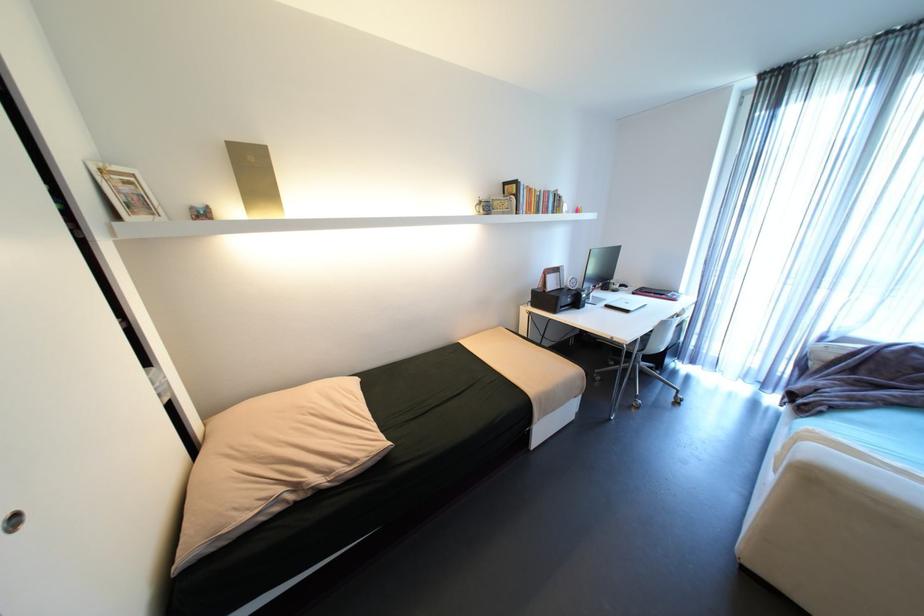
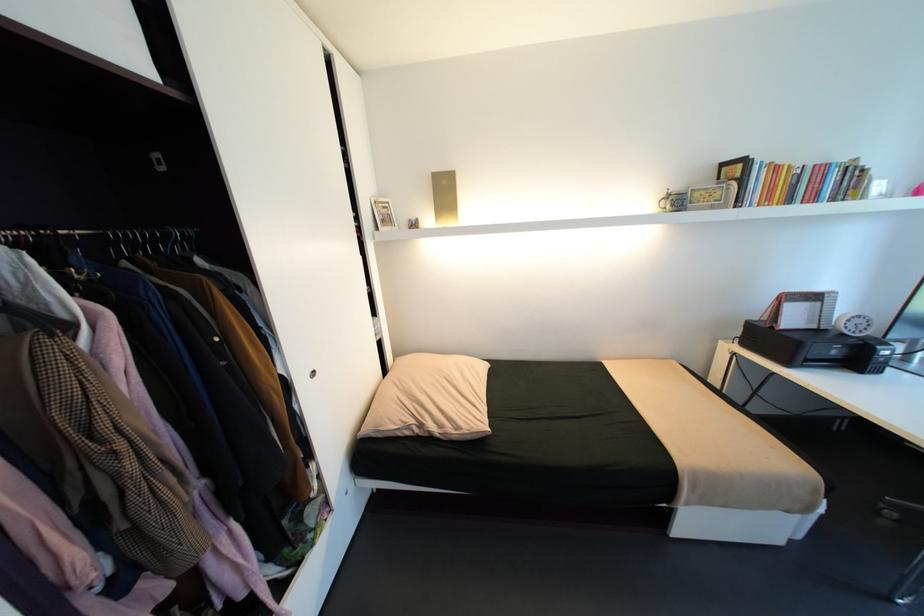
The point at (285,509) is marked in the first image. Where is the corresponding point in the second image?

(415, 432)